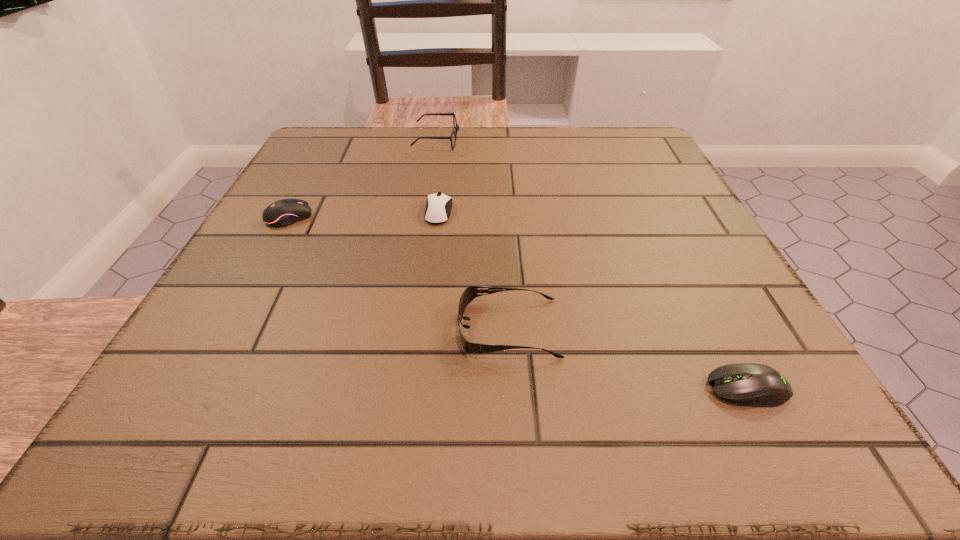
The image size is (960, 540). Identify the location of vacant space located 0.280m on the front-facing side of the fourth object from left to right. (272, 328).

You are a GUI agent. You are given a task and a screenshot of the screen. Output one action in this format:
    pyautogui.click(x=<x>, y=<y>)
    Task: Click on the free space located on the front-facing side of the fourth object from left to right
    This screenshot has height=540, width=960.
    Given the screenshot: What is the action you would take?
    pyautogui.click(x=331, y=328)

Locate an element on the screen. The width and height of the screenshot is (960, 540). free location located 0.260m on the front-facing side of the fourth object from left to right is located at coordinates (285, 328).

Find the location of a particular element. free space located 0.400m on the right of the second computer mouse from right to left is located at coordinates (653, 212).

Where is `free point located on the wheel side of the rightmost object`? The height and width of the screenshot is (540, 960). free point located on the wheel side of the rightmost object is located at coordinates (517, 388).

This screenshot has height=540, width=960. Find the location of `vacant space located on the wheel side of the rightmost object`. vacant space located on the wheel side of the rightmost object is located at coordinates (465, 388).

Where is `vacant space positioned on the wheel side of the rightmost object`? vacant space positioned on the wheel side of the rightmost object is located at coordinates (494, 388).

Where is `object positioned at the far edge`? The height and width of the screenshot is (540, 960). object positioned at the far edge is located at coordinates (456, 127).

Locate an element on the screen. object that is at the near edge is located at coordinates (748, 384).

You are a GUI agent. You are given a task and a screenshot of the screen. Output one action in this format:
    pyautogui.click(x=<x>, y=<y>)
    Task: Click on the object that is at the left edge
    This screenshot has width=960, height=540.
    Given the screenshot: What is the action you would take?
    pyautogui.click(x=284, y=212)